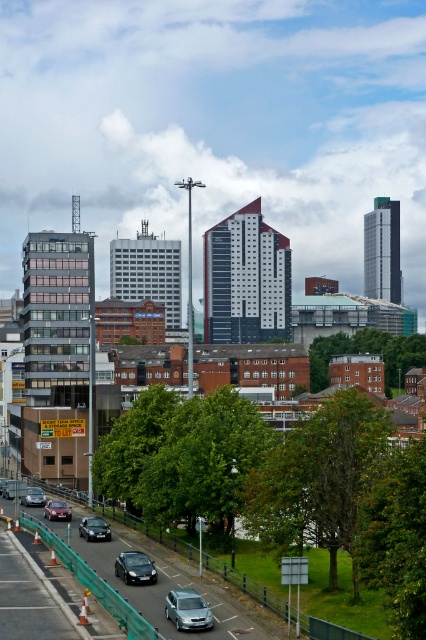
Does silver metallic car at center have a lesser width compared to shiny black car at lower left?

In fact, silver metallic car at center might be wider than shiny black car at lower left.

Who is shorter, silver metallic car at center or shiny black car at lower left?

shiny black car at lower left

Find the location of `silver metallic car at center`. silver metallic car at center is located at coordinates (176, 588).

Can you confirm if silver metallic car at center is thinner than matte silver car at lower left?

In fact, silver metallic car at center might be wider than matte silver car at lower left.

Who is higher up, silver metallic car at center or matte silver car at lower left?

matte silver car at lower left is above.

Is point (169, 588) closer to camera compared to point (25, 500)?

Yes, point (169, 588) is closer to viewer.

Where is `silver metallic car at center`? The height and width of the screenshot is (640, 426). silver metallic car at center is located at coordinates (176, 588).

What do you see at coordinates (176, 588) in the screenshot?
I see `silver metallic car at center` at bounding box center [176, 588].

Does silver metallic car at center have a lesser width compared to satin silver car at lower center?

No.

Between point (204, 573) and point (184, 602), which one is positioned behind?

Positioned behind is point (204, 573).

At what (x,y) coordinates should I click in order to perform the action: click on silver metallic car at center. Please return your answer as a coordinate pair (x, y). The height and width of the screenshot is (640, 426). Looking at the image, I should click on (176, 588).